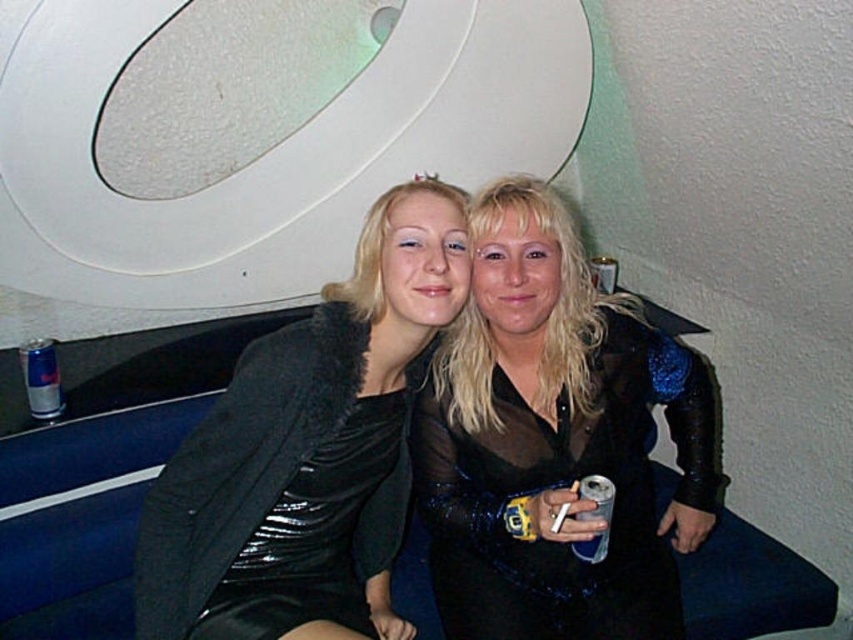
Question: In this image, where is velvet black dress at center located relative to black sequined dress at center?

Choices:
 (A) right
 (B) left

Answer: (B)

Question: From the image, what is the correct spatial relationship of velvet black dress at center in relation to black sequined dress at center?

Choices:
 (A) above
 (B) below

Answer: (A)

Question: Among these points, which one is nearest to the camera?

Choices:
 (A) (386, 589)
 (B) (648, 413)

Answer: (A)

Question: Which point is closer to the camera?

Choices:
 (A) (154, 580)
 (B) (511, 556)

Answer: (A)

Question: Observing the image, what is the correct spatial positioning of velvet black dress at center in reference to black sequined dress at center?

Choices:
 (A) below
 (B) above

Answer: (B)